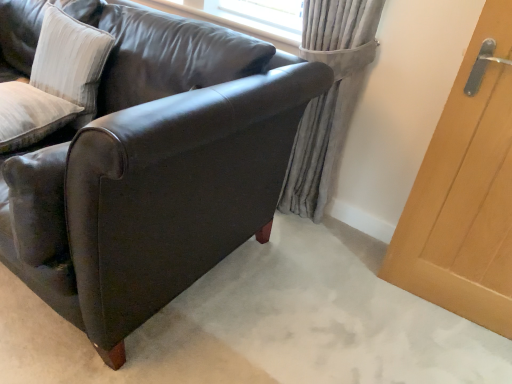
Question: From a real-world perspective, is white textured cushion at upper left, the 2th pillow in the bottom-to-top sequence, positioned over gray fabric curtain at upper right based on gravity?

Choices:
 (A) no
 (B) yes

Answer: (B)

Question: Considering the relative sizes of white textured cushion at upper left, the 1th pillow from the top, and gray fabric curtain at upper right in the image provided, is white textured cushion at upper left, the 1th pillow from the top, wider than gray fabric curtain at upper right?

Choices:
 (A) no
 (B) yes

Answer: (A)

Question: Is gray fabric curtain at upper right a part of white textured cushion at upper left, the 1th pillow from the top?

Choices:
 (A) no
 (B) yes

Answer: (A)

Question: Is white textured cushion at upper left, the 2th pillow in the bottom-to-top sequence, facing away from gray fabric curtain at upper right?

Choices:
 (A) no
 (B) yes

Answer: (A)

Question: Considering the relative positions of white textured cushion at upper left, the 2th pillow in the bottom-to-top sequence, and gray fabric curtain at upper right in the image provided, is white textured cushion at upper left, the 2th pillow in the bottom-to-top sequence, to the right of gray fabric curtain at upper right from the viewer's perspective?

Choices:
 (A) no
 (B) yes

Answer: (A)

Question: In the image, is white textured cushion at upper left, the 1th pillow from the top, positioned in front of or behind light brown wood door at right?

Choices:
 (A) front
 (B) behind

Answer: (B)

Question: Is white textured cushion at upper left, the 2th pillow in the bottom-to-top sequence, to the left or to the right of light brown wood door at right in the image?

Choices:
 (A) left
 (B) right

Answer: (A)

Question: Considering the positions of white textured cushion at upper left, the 2th pillow in the bottom-to-top sequence, and light brown wood door at right in the image, is white textured cushion at upper left, the 2th pillow in the bottom-to-top sequence, bigger or smaller than light brown wood door at right?

Choices:
 (A) big
 (B) small

Answer: (B)

Question: From the image's perspective, relative to light brown wood door at right, is white textured cushion at upper left, the 2th pillow in the bottom-to-top sequence, above or below?

Choices:
 (A) below
 (B) above

Answer: (B)

Question: Is white textured pillow at upper left, which ranks as the 1th pillow in bottom-to-top order, inside or outside of white textured cushion at upper left, the 1th pillow from the top?

Choices:
 (A) outside
 (B) inside

Answer: (A)

Question: Considering the positions of white textured pillow at upper left, the 2th pillow viewed from the top, and white textured cushion at upper left, the 1th pillow from the top, in the image, is white textured pillow at upper left, the 2th pillow viewed from the top, taller or shorter than white textured cushion at upper left, the 1th pillow from the top,?

Choices:
 (A) tall
 (B) short

Answer: (B)

Question: From the image's perspective, is white textured pillow at upper left, which ranks as the 1th pillow in bottom-to-top order, located above or below white textured cushion at upper left, the 2th pillow in the bottom-to-top sequence?

Choices:
 (A) below
 (B) above

Answer: (A)

Question: From a real-world perspective, is white textured pillow at upper left, the 2th pillow viewed from the top, above or below white textured cushion at upper left, the 1th pillow from the top?

Choices:
 (A) above
 (B) below

Answer: (B)

Question: In terms of height, does white textured pillow at upper left, the 2th pillow viewed from the top, look taller or shorter compared to light brown wood door at right?

Choices:
 (A) tall
 (B) short

Answer: (B)

Question: From a real-world perspective, is white textured pillow at upper left, which ranks as the 1th pillow in bottom-to-top order, positioned above or below light brown wood door at right?

Choices:
 (A) below
 (B) above

Answer: (A)